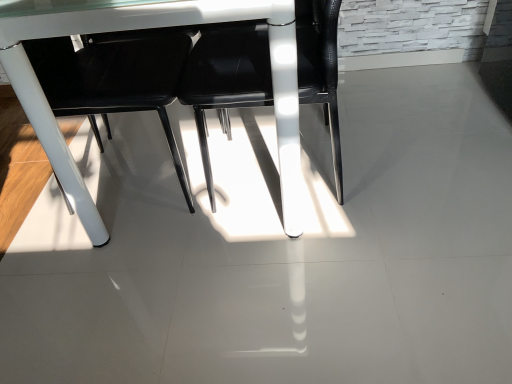
What are the coordinates of `free spot in front of black leather chair at center, which is the 1th chair from left to right` in the screenshot? It's located at (120, 288).